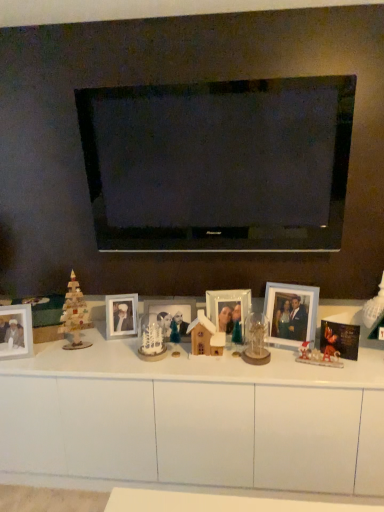
Question: Considering their positions, is white matte table at center located in front of or behind wooden house at center, which is the second toy in right-to-left order?

Choices:
 (A) front
 (B) behind

Answer: (A)

Question: Considering the positions of white matte table at center and wooden house at center, the second toy in the left-to-right sequence, in the image, is white matte table at center wider or thinner than wooden house at center, the second toy in the left-to-right sequence,?

Choices:
 (A) thin
 (B) wide

Answer: (B)

Question: Estimate the real-world distances between objects in this image. Which object is farther from the wooden house at center, which is the second toy in right-to-left order?

Choices:
 (A) metallic gold ornament at center-right, positioned as the 3th toy in left-to-right order
 (B) metallic silver photo frame at center, the 4th picture frame in the left-to-right sequence
 (C) wooden photo frame at center, which is the 5th picture frame from left to right
 (D) white frosted glass christmas tree at center, the first toy in the left-to-right sequence
 (E) matte silver picture frame at left, placed as the first picture frame when sorted from left to right

Answer: (E)

Question: Which object is positioned farthest from the white glossy picture frame at center, marked as the 4th picture frame in a right-to-left arrangement?

Choices:
 (A) wooden house at center, which is the second toy in right-to-left order
 (B) matte silver picture frame at left, the 5th picture frame in the right-to-left sequence
 (C) metallic silver photo frame at center, positioned as the 2th picture frame in right-to-left order
 (D) wooden photo frame at center, which is the 5th picture frame from left to right
 (E) wooden christmas tree at left

Answer: (D)